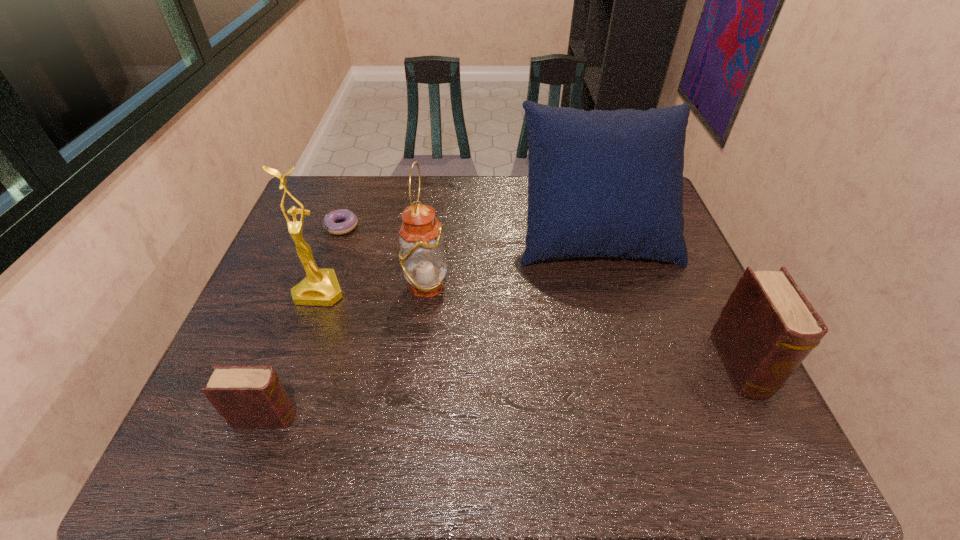
The height and width of the screenshot is (540, 960). Identify the location of the left diary. (248, 397).

Find the location of a particular element. This screenshot has width=960, height=540. the nearer diary is located at coordinates (248, 397).

Where is `the fourth tallest object`? Image resolution: width=960 pixels, height=540 pixels. the fourth tallest object is located at coordinates (767, 328).

This screenshot has height=540, width=960. I want to click on the second nearest object, so click(x=767, y=328).

This screenshot has width=960, height=540. I want to click on doughnut, so click(x=350, y=223).

The image size is (960, 540). I want to click on the third object from right to left, so click(x=422, y=256).

The height and width of the screenshot is (540, 960). Find the location of `cushion`. cushion is located at coordinates (601, 183).

In order to click on award in this screenshot , I will do `click(320, 288)`.

Identify the location of free region located on the spine side of the nearer diary. This screenshot has width=960, height=540. (461, 417).

At what (x,y) coordinates should I click in order to perform the action: click on free space located on the front of the shortest object. Please return your answer as a coordinate pair (x, y). The height and width of the screenshot is (540, 960). Looking at the image, I should click on (301, 340).